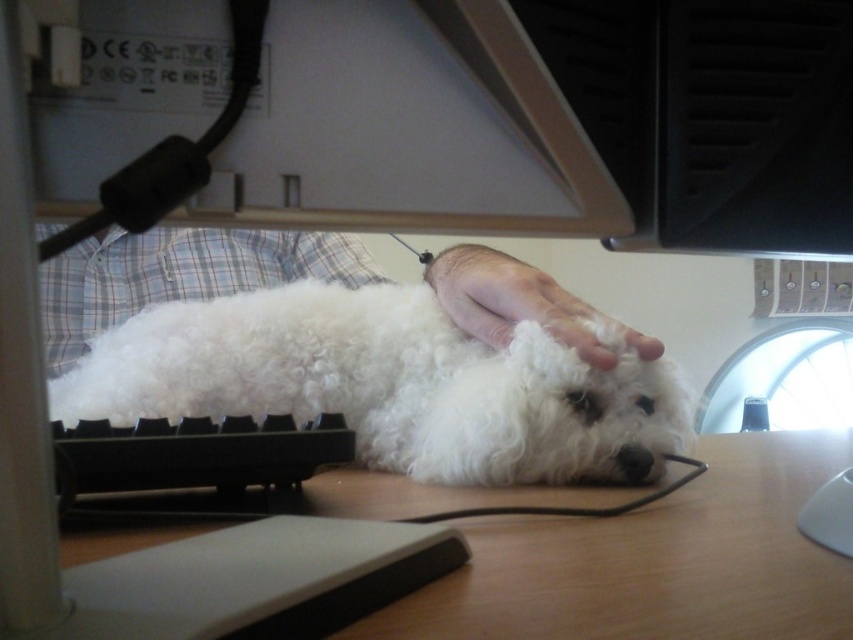
Is wooden at center shorter than white fluffy dog at center?

Yes, wooden at center is shorter than white fluffy dog at center.

Between wooden at center and white fluffy dog at center, which one has less height?

Standing shorter between the two is wooden at center.

You are a GUI agent. You are given a task and a screenshot of the screen. Output one action in this format:
    pyautogui.click(x=<x>, y=<y>)
    Task: Click on the wooden at center
    
    Given the screenshot: What is the action you would take?
    pyautogui.click(x=654, y=561)

Is wooden at center shorter than white soft hand at center?

Yes.

Based on the photo, does wooden at center appear under white soft hand at center?

Indeed, wooden at center is positioned under white soft hand at center.

This screenshot has width=853, height=640. In order to click on wooden at center in this screenshot , I will do `click(654, 561)`.

This screenshot has width=853, height=640. In order to click on wooden at center in this screenshot , I will do `click(654, 561)`.

Is the position of white curly fur dog at center less distant than that of white soft hand at center?

Yes.

Does point (97, 390) lie in front of point (483, 332)?

That is True.

Who is more forward, (x=659, y=394) or (x=442, y=298)?

Point (x=659, y=394) is in front.

Identify the location of white curly fur dog at center. The width and height of the screenshot is (853, 640). (387, 385).